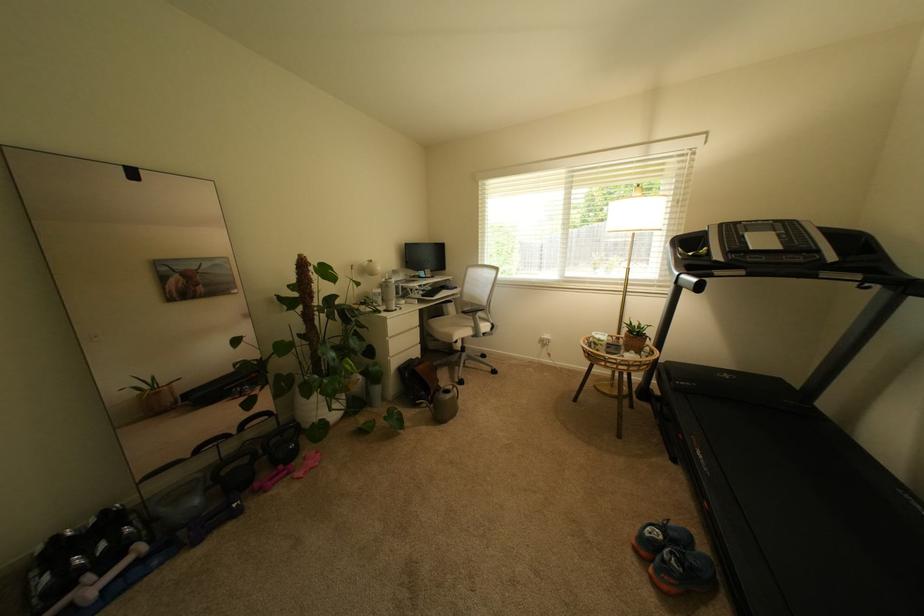
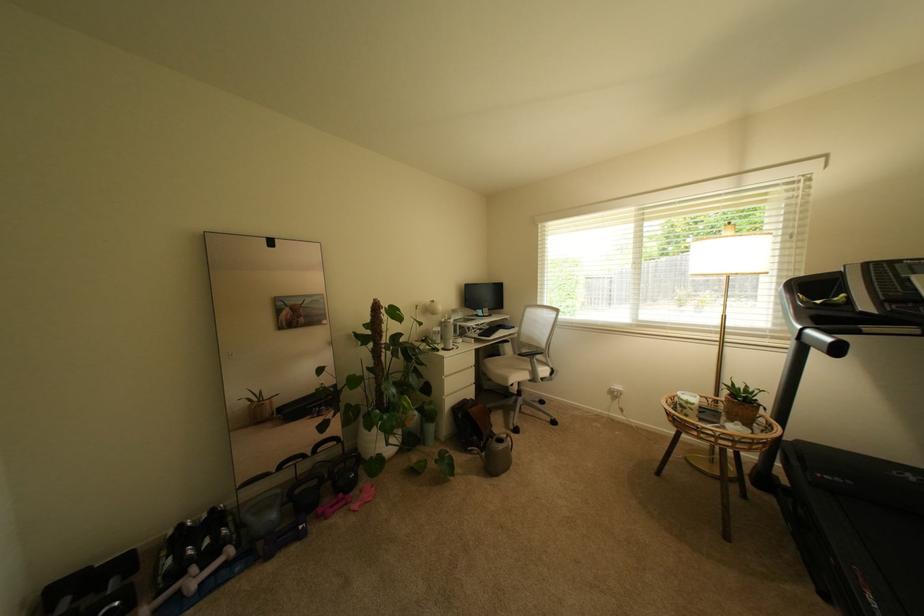
The point at (699,254) is marked in the first image. Where is the corresponding point in the second image?

(827, 302)